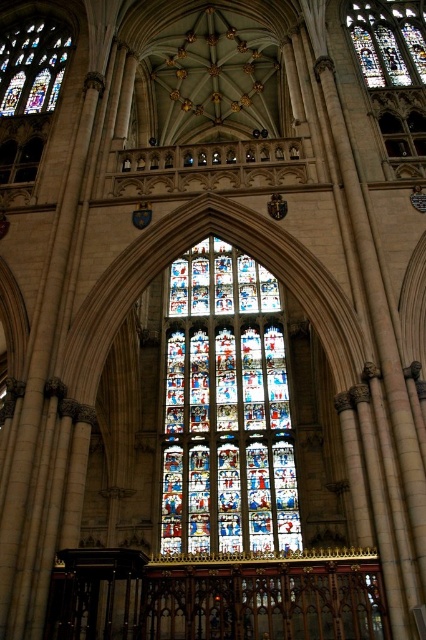
Can you confirm if stained glass window at upper center is positioned above multicolored stained glass window at center?

Incorrect, stained glass window at upper center is not positioned above multicolored stained glass window at center.

Who is more distant from viewer, (405, 109) or (362, 33)?

Positioned behind is point (362, 33).

The height and width of the screenshot is (640, 426). I want to click on stained glass window at upper center, so (394, 74).

Which is more to the right, stained glass window at center or multicolored stained glass window at center?

Positioned to the right is multicolored stained glass window at center.

Does stained glass window at center appear on the left side of multicolored stained glass window at center?

Correct, you'll find stained glass window at center to the left of multicolored stained glass window at center.

Is point (230, 464) positioned behind point (385, 35)?

No, it is in front of (385, 35).

In order to click on stained glass window at center in this screenshot , I will do `click(226, 410)`.

Between point (388, 52) and point (0, 65), which one is positioned behind?

Positioned behind is point (0, 65).

Can you confirm if stained glass window at upper center is positioned to the right of stained glass window at upper left?

Yes, stained glass window at upper center is to the right of stained glass window at upper left.

Between point (423, 29) and point (17, 77), which one is positioned behind?

The point (423, 29) is more distant.

Where is `stained glass window at upper center`? This screenshot has width=426, height=640. stained glass window at upper center is located at coordinates (394, 74).